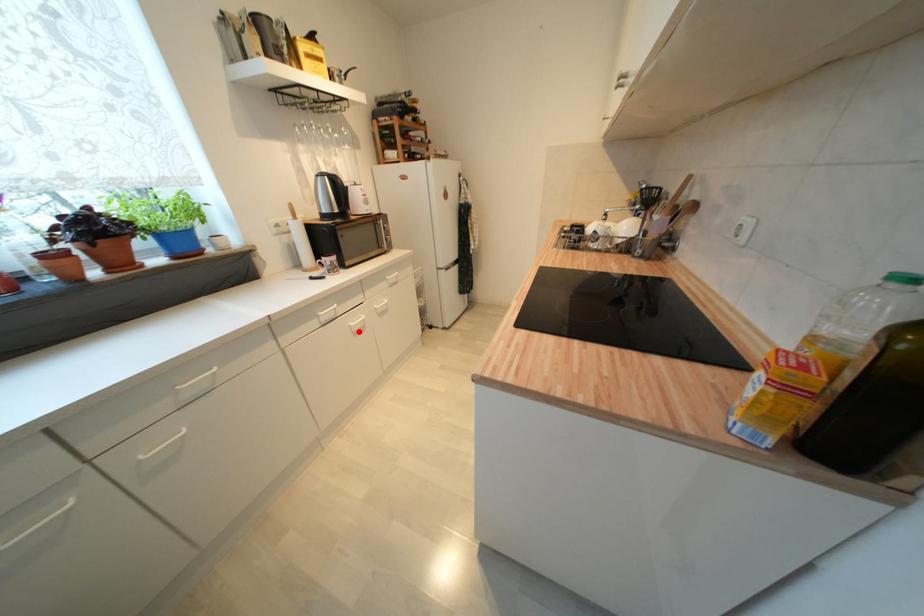
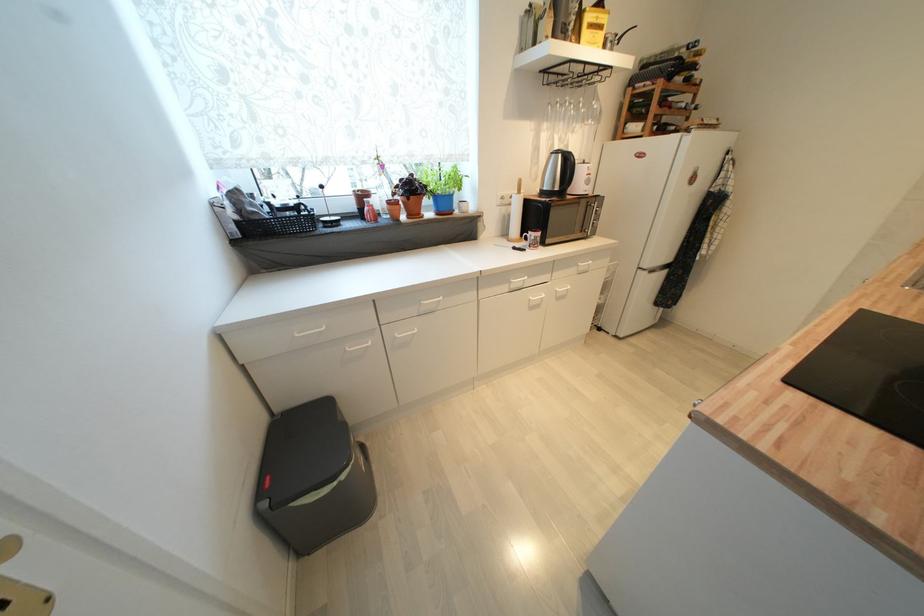
The point at the highlighted location is marked in the first image. Where is the corresponding point in the second image?

(536, 306)